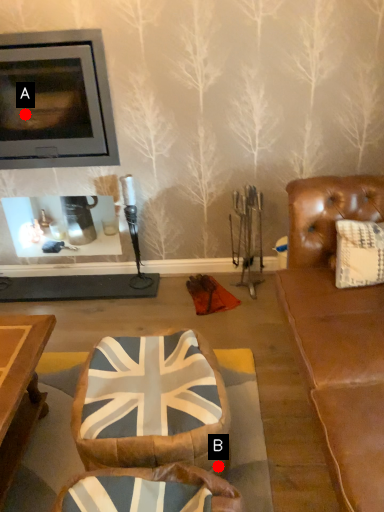
Question: Two points are circled on the image, labeled by A and B beside each circle. Which point is further to the camera?

Choices:
 (A) A is further
 (B) B is further

Answer: (A)